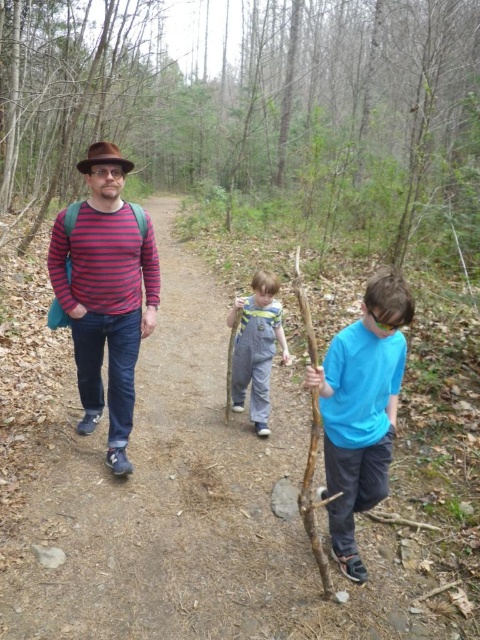
You are standing at the point labeled point (406, 321) and want to walk to the point labeled point (262, 282). Which direction should you face to move towards it?

You should face away from the viewer because point (262, 282) is further away than point (406, 321).

You are a photographer trying to capture a candid shot of the two people in the scene. Since you want to ensure both subjects are in focus, you need to know their relative positions. Which of the two, the striped cotton shirt at center or the denim overalls at center, is closer to the camera?

The striped cotton shirt at center is in front of the denim overalls at center, so the striped cotton shirt at center is closer to the camera.

You are standing at the entrance of the forest path and see the striped cotton shirt at center. If you want to reach the shirt quickly, which direction should you move towards?

The striped cotton shirt at center is located at point (106, 292), which is towards the center of the image. To reach it quickly, move towards the center of the path.